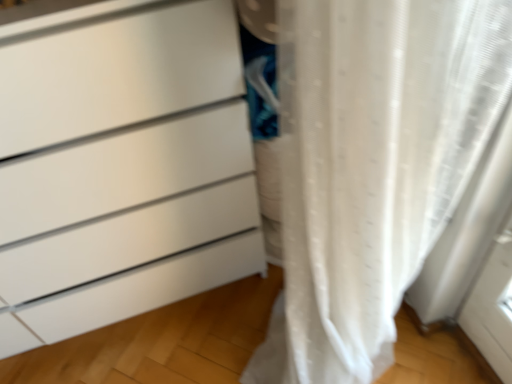
Measure the distance between white matte chest of drawers at center and camera.

The depth of white matte chest of drawers at center is 26.95 inches.

This screenshot has width=512, height=384. In order to click on white matte chest of drawers at center in this screenshot , I will do `click(121, 165)`.

This screenshot has height=384, width=512. Describe the element at coordinates (121, 165) in the screenshot. I see `white matte chest of drawers at center` at that location.

Locate an element on the screen. white matte chest of drawers at center is located at coordinates (121, 165).